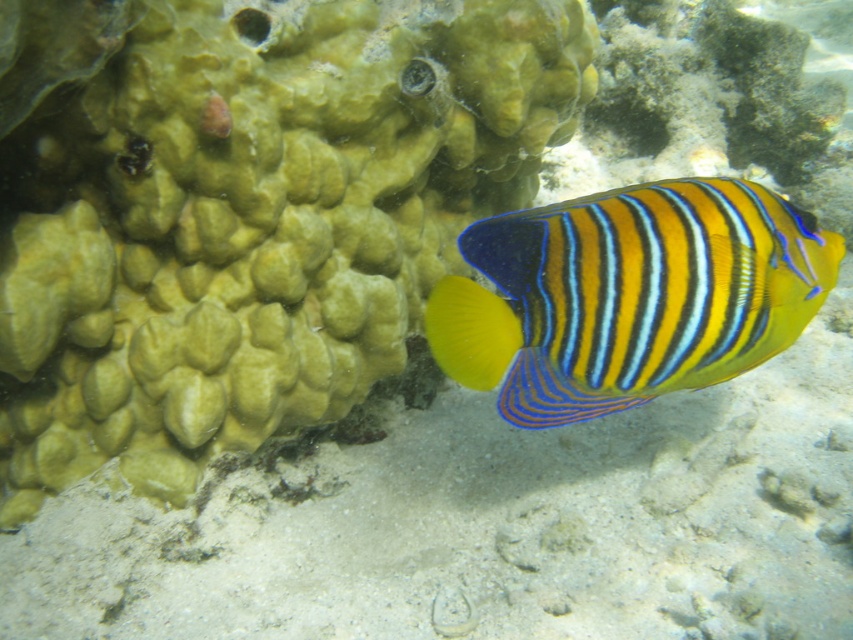
You are a marine biologist observing an underwater scene. You notice a green textured coral at center and a yellow striped fish at center. Based on their positions, which object is located to the right side of the other?

The green textured coral at center is to the left of the yellow striped fish at center, meaning the yellow striped fish at center is positioned to the right of the green textured coral at center.

You are a marine biologist filming underwater. Your camera is positioned at a certain distance from the green textured coral at center. If the recommended safe distance to avoid disturbing marine life is 30 inches, is your current position within the safe zone?

The green textured coral at center and camera are 29.58 inches apart from each other. Since 29.58 inches is less than the recommended 30 inches, your current position is slightly outside the safe zone and may disturb the marine life.

You are a marine biologist observing an underwater scene. You notice the green textured coral at center and the yellow striped fish at center. Which object occupies a larger area in the image?

The green textured coral at center has a larger size compared to the yellow striped fish at center, so it occupies a larger area in the image.